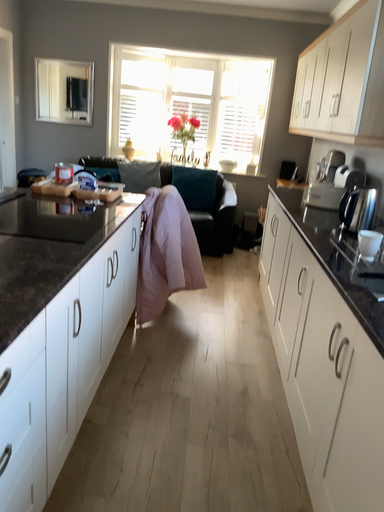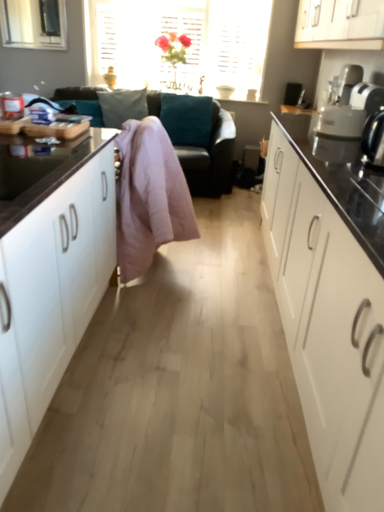
Question: How did the camera likely rotate when shooting the video?

Choices:
 (A) rotated upward
 (B) rotated downward

Answer: (B)